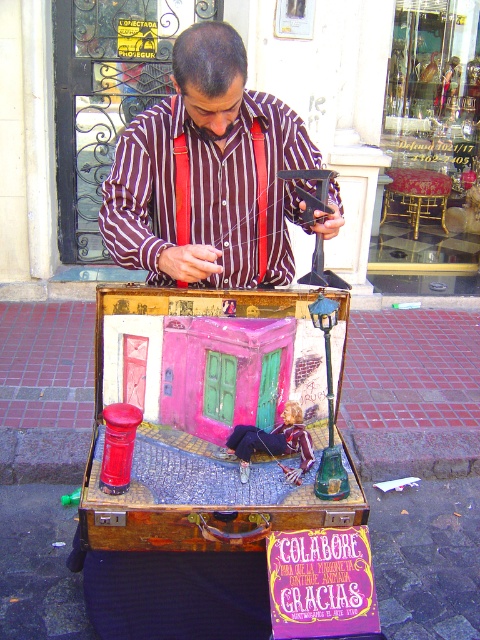
Who is more forward, (336,186) or (301,426)?

Point (301,426)

Who is more forward, (252, 157) or (231, 456)?

Point (231, 456)

I want to click on striped cotton shirt at center, so click(x=207, y=189).